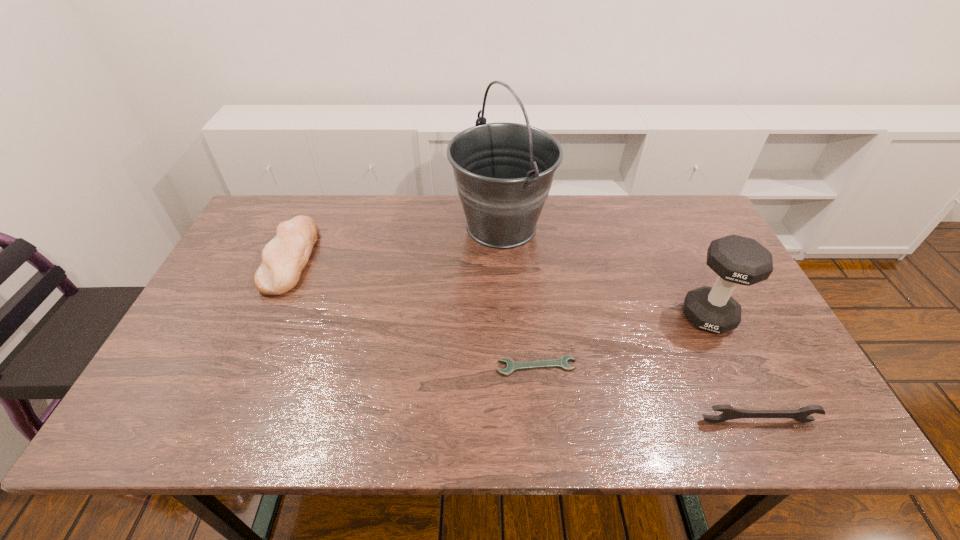
Identify the location of vacant area between the bucket and the right wrench. (630, 323).

The width and height of the screenshot is (960, 540). I want to click on vacant space that's between the tallest object and the leftmost object, so click(x=396, y=242).

Find the location of `free space between the left wrench and the taller wrench`. free space between the left wrench and the taller wrench is located at coordinates (647, 394).

Where is `free area in between the taller wrench and the tallest object`? Image resolution: width=960 pixels, height=540 pixels. free area in between the taller wrench and the tallest object is located at coordinates (630, 323).

I want to click on the fourth closest object to the right wrench, so click(x=283, y=258).

Identify which object is the second closest to the dumbbell. Please provide its 2D coordinates. Your answer should be formatted as a tuple, i.e. [(x, y)], where the tuple contains the x and y coordinates of a point satisfying the conditions above.

[(512, 366)]

Identify the location of free space that satisfies the following two spatial constraints: 1. on the front side of the second tallest object; 2. on the left side of the tallest object. (507, 316).